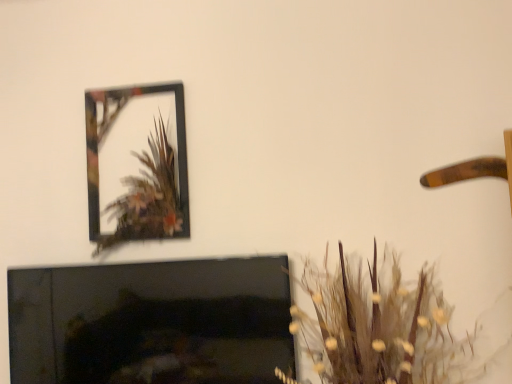
Question: Is metallic frame at upper left bigger or smaller than brown textured plant at lower right?

Choices:
 (A) small
 (B) big

Answer: (A)

Question: From a real-world perspective, is metallic frame at upper left physically located above or below brown textured plant at lower right?

Choices:
 (A) above
 (B) below

Answer: (A)

Question: Which of these objects is positioned closest to the brown textured plant at lower right?

Choices:
 (A) black glossy fireplace at lower left
 (B) metallic frame at upper left

Answer: (A)

Question: Estimate the real-world distances between objects in this image. Which object is farther from the metallic frame at upper left?

Choices:
 (A) brown textured plant at lower right
 (B) black glossy fireplace at lower left

Answer: (A)